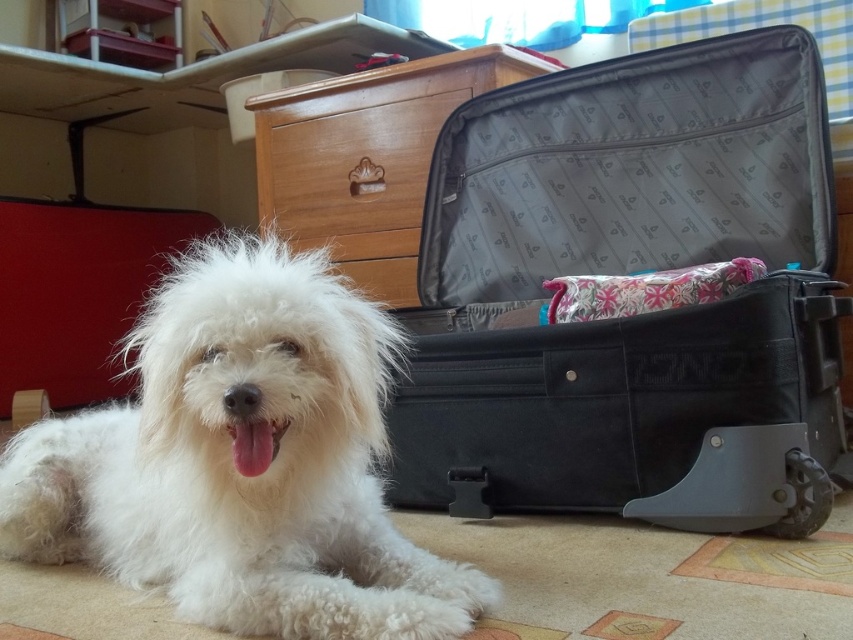
You are trying to locate the black fabric suitcase at center in the image. According to the coordinates provided, where would you look first?

You should look at point (631, 316) to find the black fabric suitcase at center.

You are trying to decide if the white fluffy dog at lower left can fit through the space between the wooden drawer at center and the wall. Based on their widths, can the dog pass through?

The white fluffy dog at lower left is thinner than the wooden drawer at center, so it can likely pass through the space between the drawer and the wall since its width is narrower.